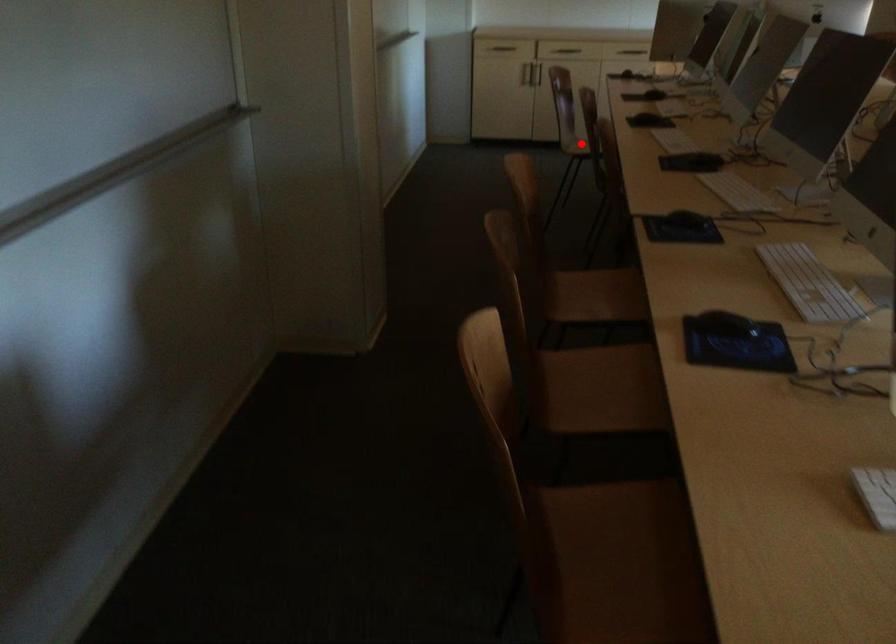
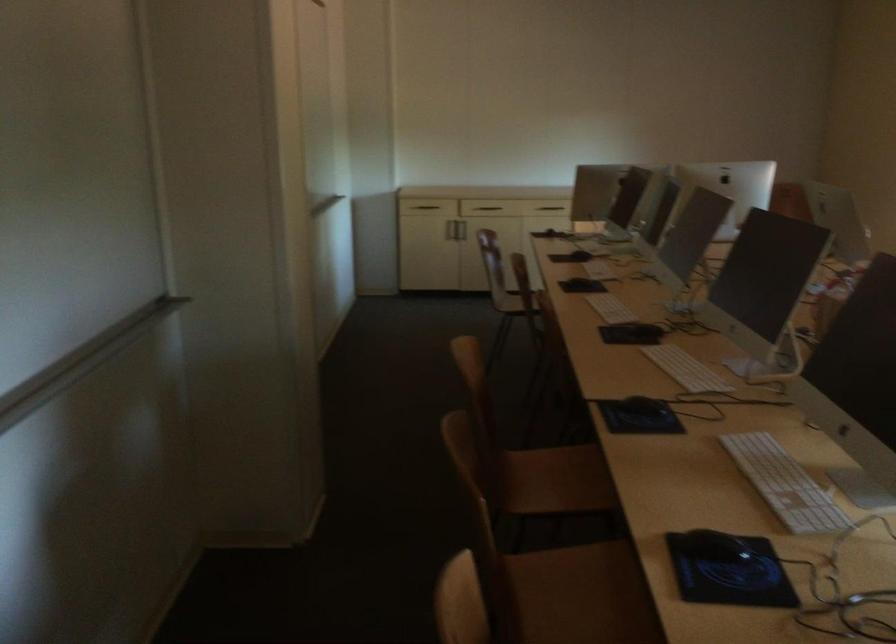
In the second image, find the point that corresponds to the highlighted location in the first image.

(512, 303)